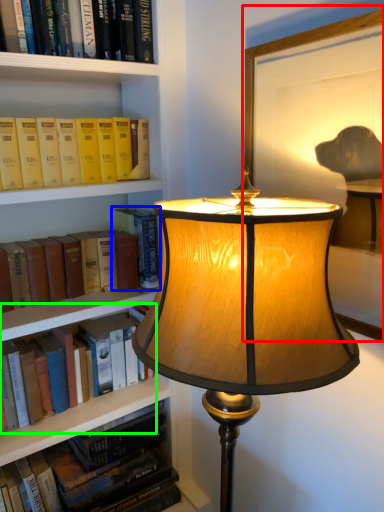
Question: Estimate the real-world distances between objects in this image. Which object is farther from picture frame (highlighted by a red box), book (highlighted by a blue box) or book (highlighted by a green box)?

Choices:
 (A) book
 (B) book

Answer: (B)